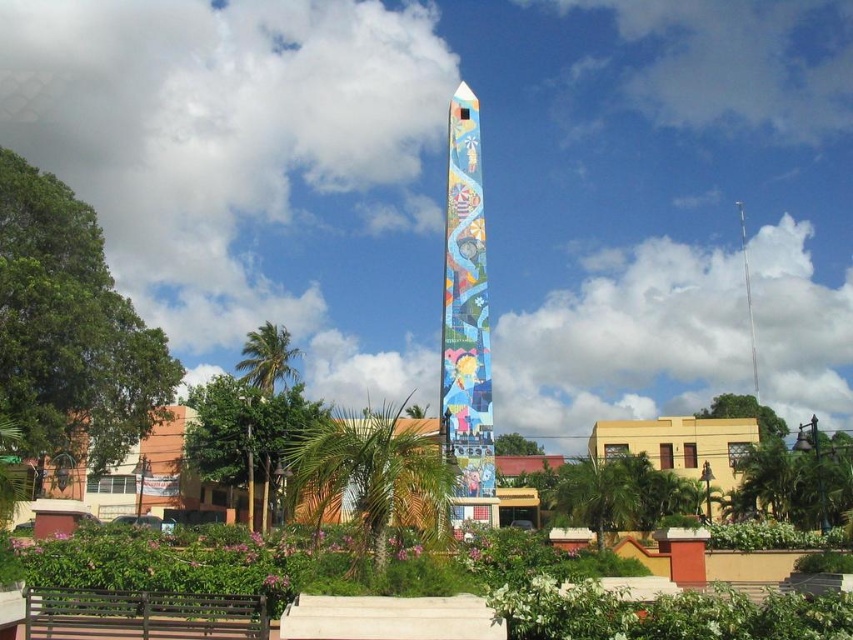
You are a tourist visiting the monument and want to sit on the brown wooden bench at lower left. From your current position in front of the multicolored mosaic obelisk at center, can you directly walk to the bench without moving around the obelisk?

The brown wooden bench at lower left is behind the multicolored mosaic obelisk at center, so you cannot directly walk to the bench without moving around the obelisk.

You are standing at the point marked as point (466,321) in the image. What object can you see directly in front of you?

The multicolored mosaic obelisk at center is located at point (466,321), so you can see it directly in front of you.